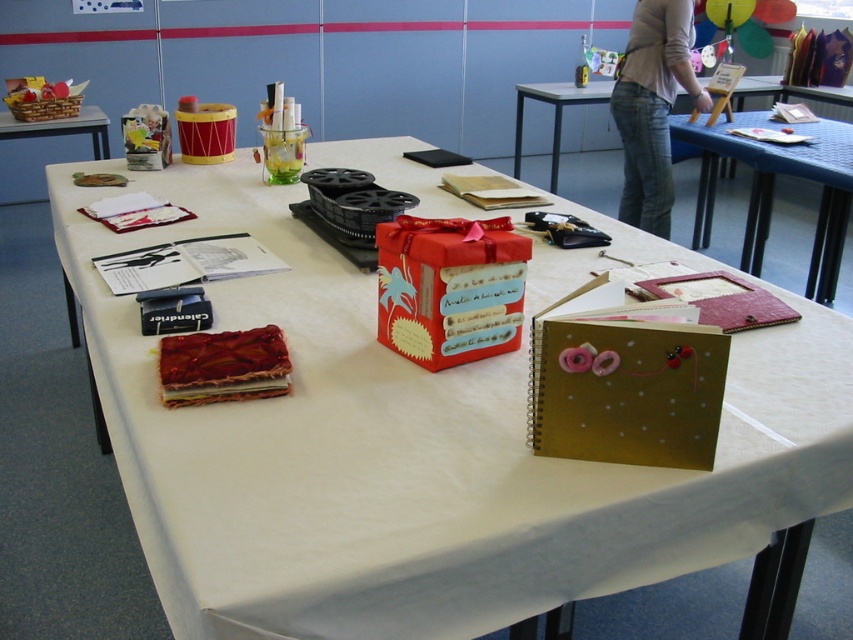
You are standing at the edge of the table looking towards the center. There are two points marked on the table surface. One is at point (834, 145) and the other at point (61, 128). Which point is closer to you?

Point (61, 128) is closer to you because it is positioned behind point (834, 145), making it farther away from your current position at the edge of the table.